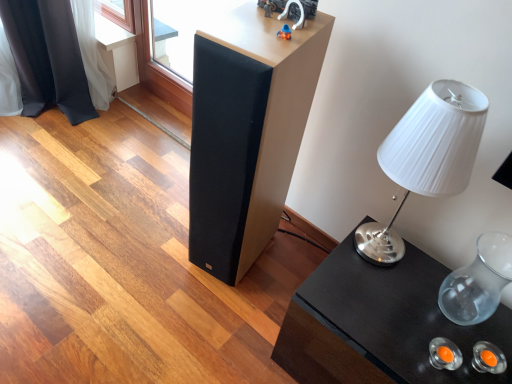
Locate an element on the screen. Image resolution: width=512 pixels, height=384 pixels. free space above matte black speaker at center (from a real-world perspective) is located at coordinates (278, 22).